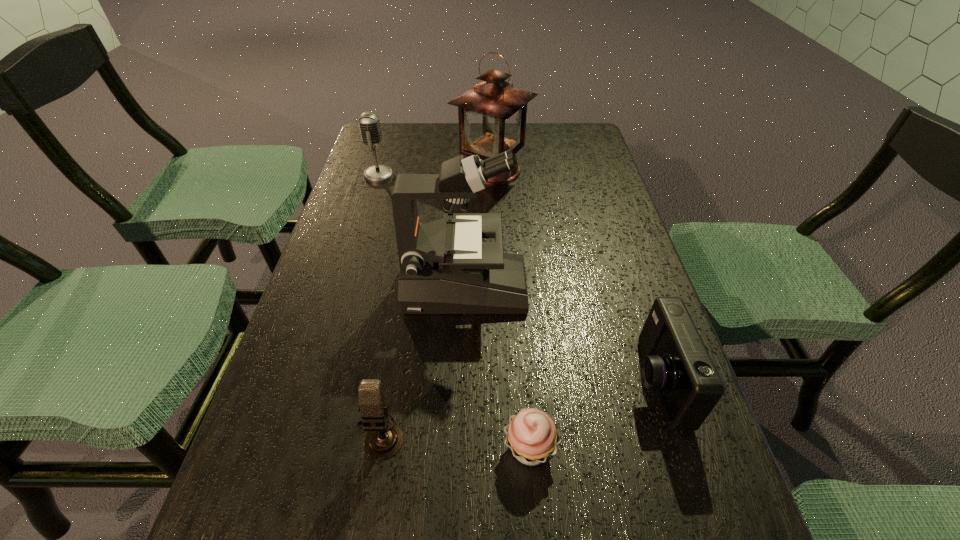
Where is `object that stands as the second closest to the microscope`? This screenshot has width=960, height=540. object that stands as the second closest to the microscope is located at coordinates (384, 439).

Locate which object ranks in proximity to the oil lamp. Please provide its 2D coordinates. Your answer should be formatted as a tuple, i.e. [(x, y)], where the tuple contains the x and y coordinates of a point satisfying the conditions above.

[(369, 124)]

Where is `blank area in the image that satisfies the following two spatial constraints: 1. on the front side of the farther microphone; 2. on the right side of the cupcake`? blank area in the image that satisfies the following two spatial constraints: 1. on the front side of the farther microphone; 2. on the right side of the cupcake is located at coordinates (298, 448).

At what (x,y) coordinates should I click in order to perform the action: click on vacant space that satisfies the following two spatial constraints: 1. through the eyepieces of the microscope; 2. on the back side of the shortest object. Please return your answer as a coordinate pair (x, y). This screenshot has height=540, width=960. Looking at the image, I should click on (460, 448).

The width and height of the screenshot is (960, 540). Find the location of `vacant space that satisfies the following two spatial constraints: 1. on the front-facing side of the camera; 2. on the front-facing side of the right microphone`. vacant space that satisfies the following two spatial constraints: 1. on the front-facing side of the camera; 2. on the front-facing side of the right microphone is located at coordinates (673, 435).

Identify the location of vacant space that satisfies the following two spatial constraints: 1. on the back side of the oil lamp; 2. on the left side of the taller microphone. (380, 170).